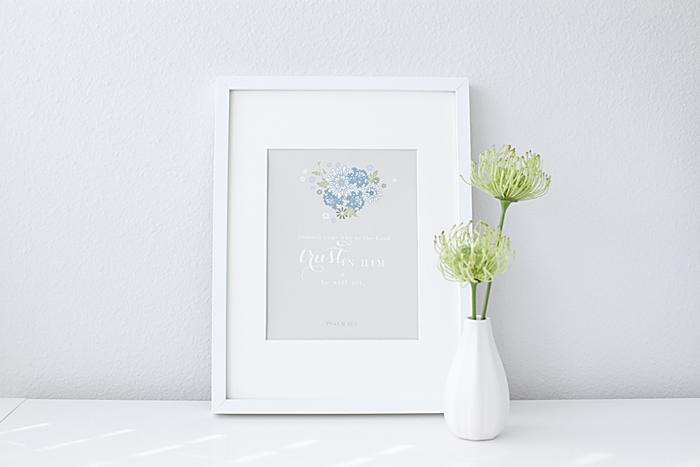
Locate an element on the screen. The height and width of the screenshot is (467, 700). white frame is located at coordinates (220, 334).